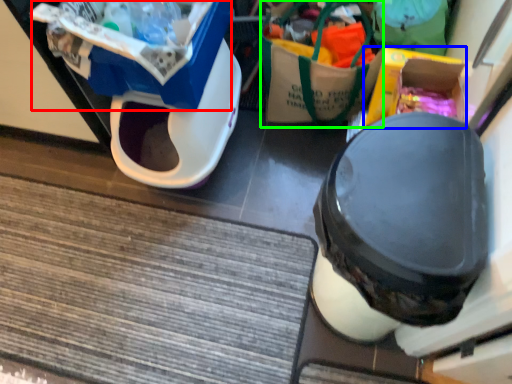
Question: Estimate the real-world distances between objects in this image. Which object is farther from storage box (highlighted by a red box), storage box (highlighted by a blue box) or garbage (highlighted by a green box)?

Choices:
 (A) storage box
 (B) garbage

Answer: (A)